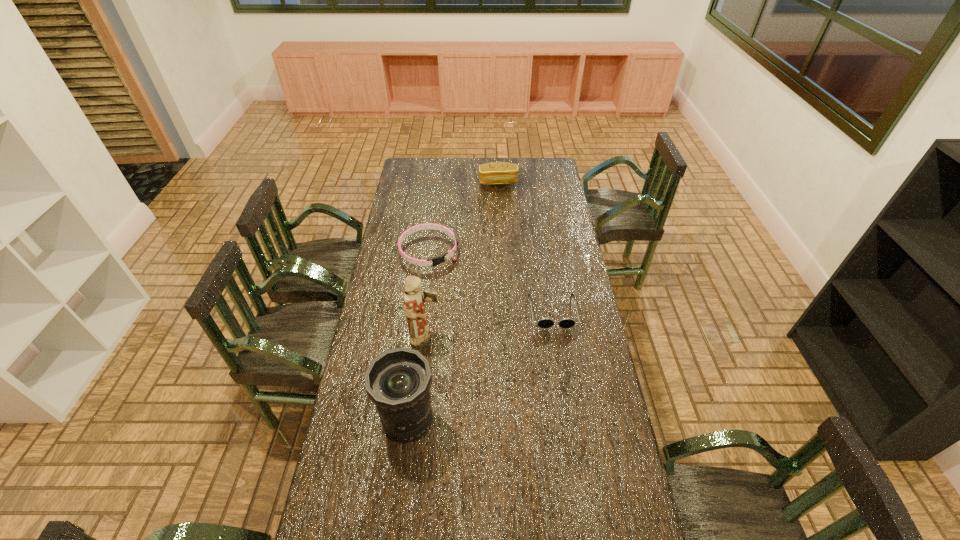
I want to click on blank space located on the zipper side of the third shortest object, so click(x=500, y=208).

I want to click on vacant space located on the zipper side of the third shortest object, so click(x=499, y=201).

At what (x,y) coordinates should I click in order to perform the action: click on free space located on the front-facing side of the figurine. Please return your answer as a coordinate pair (x, y). This screenshot has height=540, width=960. Looking at the image, I should click on (485, 347).

At what (x,y) coordinates should I click in order to perform the action: click on free space located 0.360m on the front-facing side of the figurine. Please return your answer as a coordinate pair (x, y). This screenshot has width=960, height=540. Looking at the image, I should click on (534, 354).

Identify the location of vacant position located 0.200m on the front-facing side of the figurine. (492, 348).

Locate an element on the screen. free region located with the buckle on the fourth nearest object is located at coordinates (459, 293).

Where is `free spot located 0.050m with the buckle on the fourth nearest object`? free spot located 0.050m with the buckle on the fourth nearest object is located at coordinates (446, 276).

Locate an element on the screen. vacant space located with the buckle on the fourth nearest object is located at coordinates (453, 286).

What are the coordinates of `object that is positioned at the far edge` in the screenshot? It's located at click(x=496, y=173).

The image size is (960, 540). Identify the location of telephoto lens located at the left edge. (398, 381).